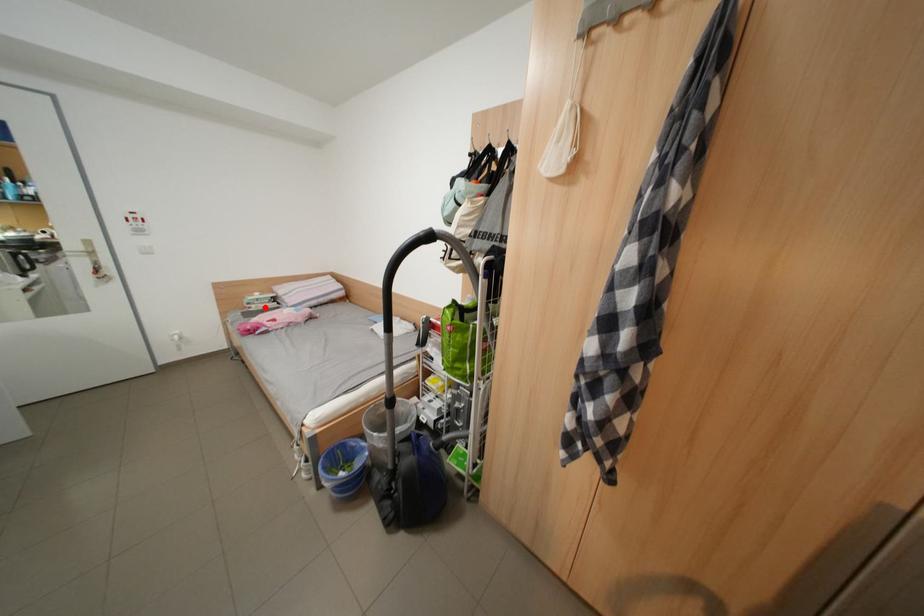
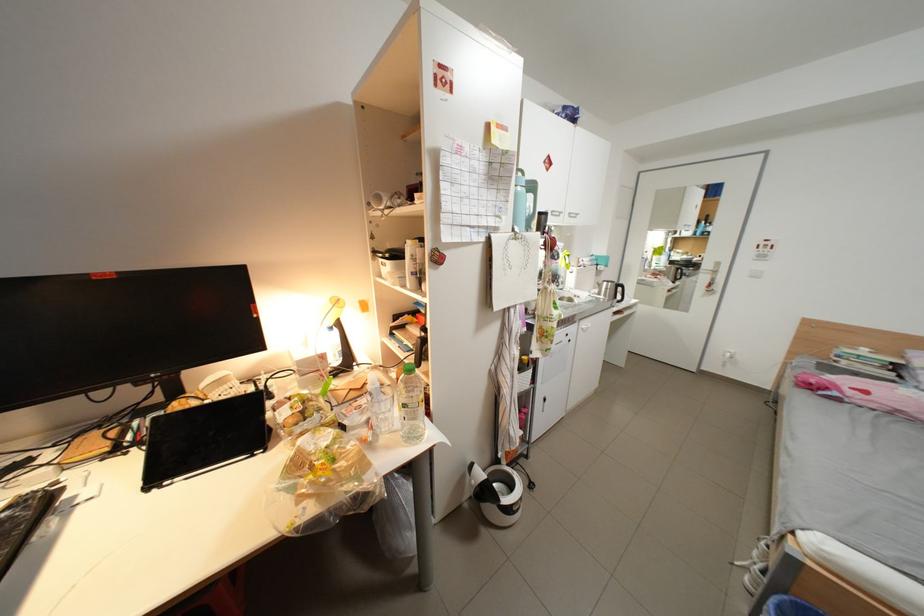
Question: I am providing you with two images of the same scene from different viewpoints. Image1 has a red point marked. In image2, the corresponding 3D location appears at what relative position? Reply with the corresponding letter.

Choices:
 (A) Closer
 (B) Farther

Answer: (B)